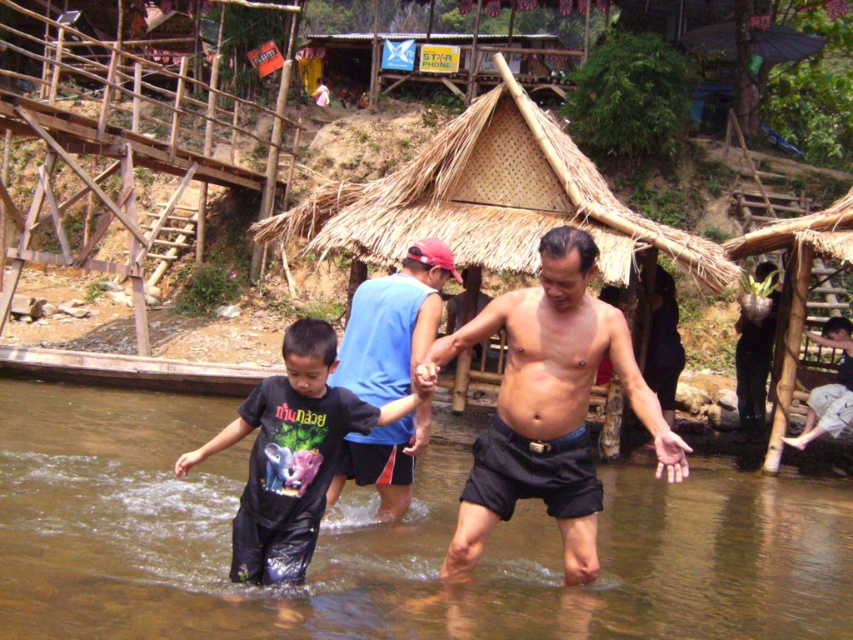
Question: Considering the real-world distances, which object is farthest from the dark blue shorts at lower right?

Choices:
 (A) black matte t-shirt at center
 (B) matte black shorts at center
 (C) blue sleeveless shirt at center

Answer: (A)

Question: Does matte black shorts at center appear under blue sleeveless shirt at center?

Choices:
 (A) yes
 (B) no

Answer: (A)

Question: Among these points, which one is nearest to the camera?

Choices:
 (A) (814, 404)
 (B) (674, 616)
 (C) (390, 323)

Answer: (B)

Question: Is black matte t-shirt at center below dark blue shorts at lower right?

Choices:
 (A) yes
 (B) no

Answer: (A)

Question: Where is black matte t-shirt at center located in relation to blue sleeveless shirt at center in the image?

Choices:
 (A) left
 (B) right

Answer: (A)

Question: Based on their relative distances, which object is farther from the brown muddy stream at center?

Choices:
 (A) blue sleeveless shirt at center
 (B) dark blue shorts at lower right

Answer: (B)